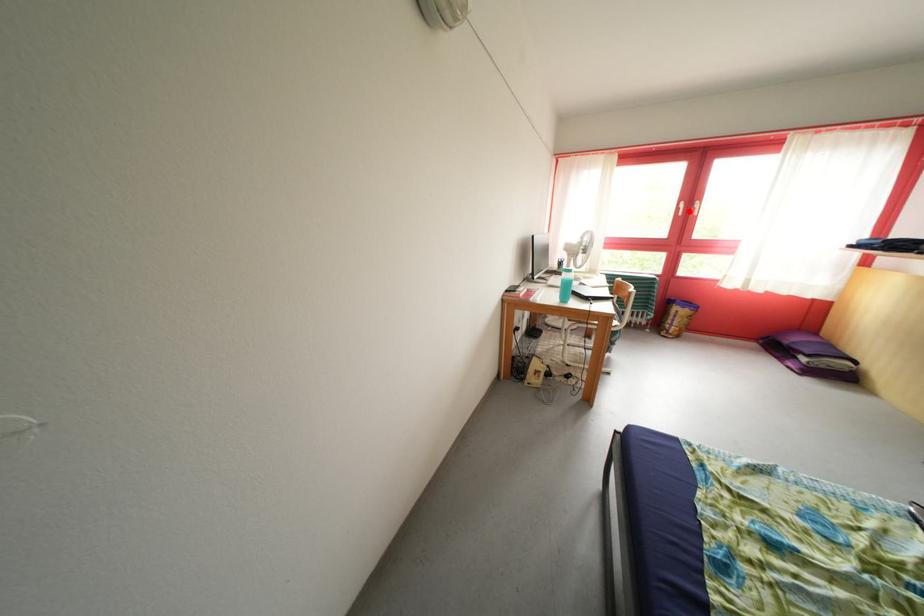
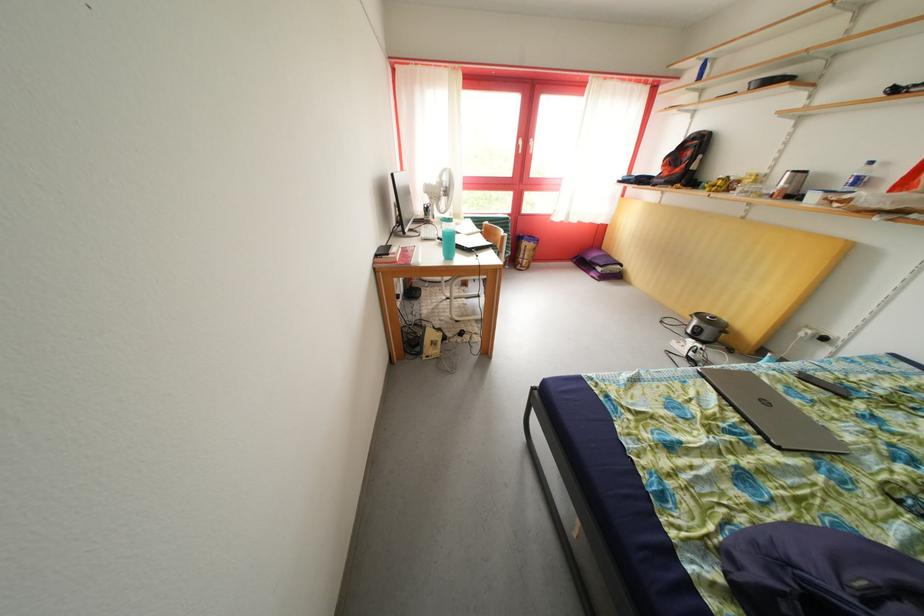
Where in the second image is the point corresponding to the highlighted location from the first image?

(528, 148)